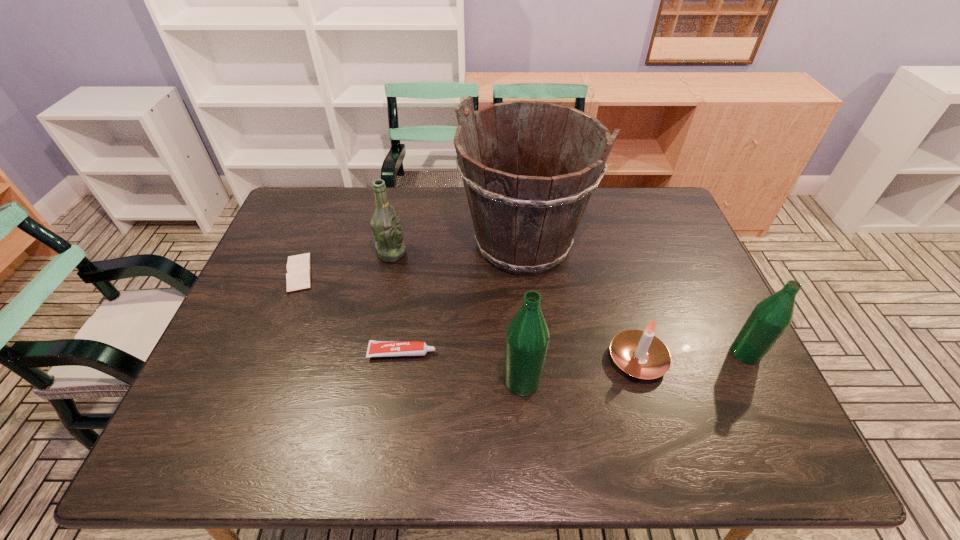
In order to click on free spot between the fifth tallest object and the taller bottle in this screenshot , I will do `click(580, 370)`.

Where is `vacant area that lies between the toothpaste and the bucket`? The width and height of the screenshot is (960, 540). vacant area that lies between the toothpaste and the bucket is located at coordinates (463, 298).

In order to click on vacant area that lies between the tallest object and the right bottle in this screenshot , I will do `click(634, 298)`.

Where is `vacant area between the beer bottle and the shortest object`? vacant area between the beer bottle and the shortest object is located at coordinates (346, 263).

This screenshot has width=960, height=540. Find the location of `the third closest object to the beer bottle`. the third closest object to the beer bottle is located at coordinates (375, 348).

Find the location of a particular element. The image size is (960, 540). object that stands as the sixth closest to the right bottle is located at coordinates (298, 276).

Locate an element on the screen. This screenshot has height=540, width=960. free space that satisfies the following two spatial constraints: 1. on the surface of the beer bottle; 2. on the back side of the candle is located at coordinates (371, 360).

Locate an element on the screen. The image size is (960, 540). vacant space that satisfies the following two spatial constraints: 1. on the surface of the beer bottle; 2. on the right side of the right bottle is located at coordinates (372, 353).

Identify the location of vacant space that satisfies the following two spatial constraints: 1. on the back side of the shorter bottle; 2. on the right side of the taller bottle. (520, 353).

Where is `vacant area in the image that satisfies the following two spatial constraints: 1. at the nozzle of the second shortest object; 2. on the left side of the right bottle`? vacant area in the image that satisfies the following two spatial constraints: 1. at the nozzle of the second shortest object; 2. on the left side of the right bottle is located at coordinates (402, 353).